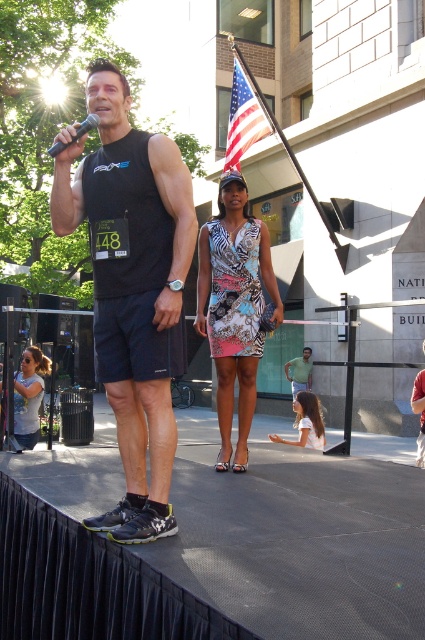
Question: Which object is farther from the camera taking this photo?

Choices:
 (A) american flag at upper center
 (B) black matte tank top at center

Answer: (A)

Question: Does american flag at upper center have a greater width compared to black plastic microphone at upper left?

Choices:
 (A) no
 (B) yes

Answer: (B)

Question: Among these objects, which one is farthest from the camera?

Choices:
 (A) black matte tank top at center
 (B) matte gray tank top at lower left

Answer: (B)

Question: Is black matte tank top at center to the left of american flag at upper center from the viewer's perspective?

Choices:
 (A) yes
 (B) no

Answer: (A)

Question: Considering the real-world distances, which object is closest to the american flag at upper center?

Choices:
 (A) black plastic microphone at upper left
 (B) matte gray tank top at lower left

Answer: (B)

Question: Observing the image, what is the correct spatial positioning of american flag at upper center in reference to matte gray tank top at lower left?

Choices:
 (A) above
 (B) below

Answer: (A)